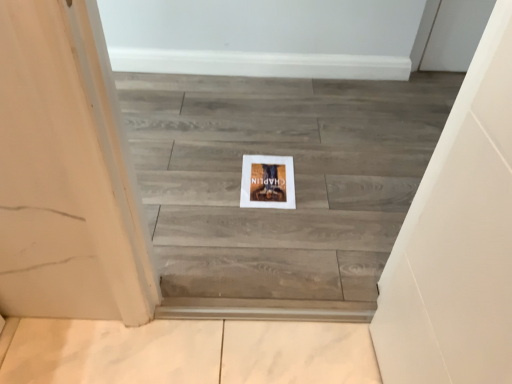
In order to click on blank space situated above white paper at center (from a real-world perspective) in this screenshot , I will do `click(263, 175)`.